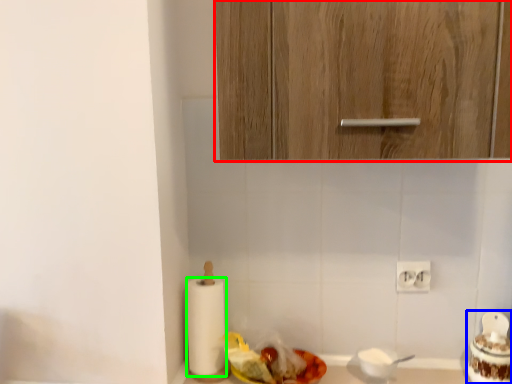
Question: Which object is positioned farthest from cabinetry (highlighted by a red box)? Select from food (highlighted by a blue box) and paper towel (highlighted by a green box).

Choices:
 (A) food
 (B) paper towel

Answer: (A)